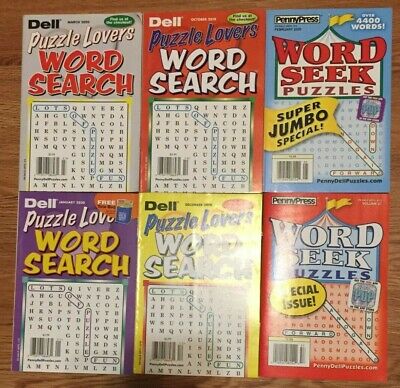
Find the location of a particular element. The width and height of the screenshot is (400, 388). red books is located at coordinates (358, 211), (248, 57).